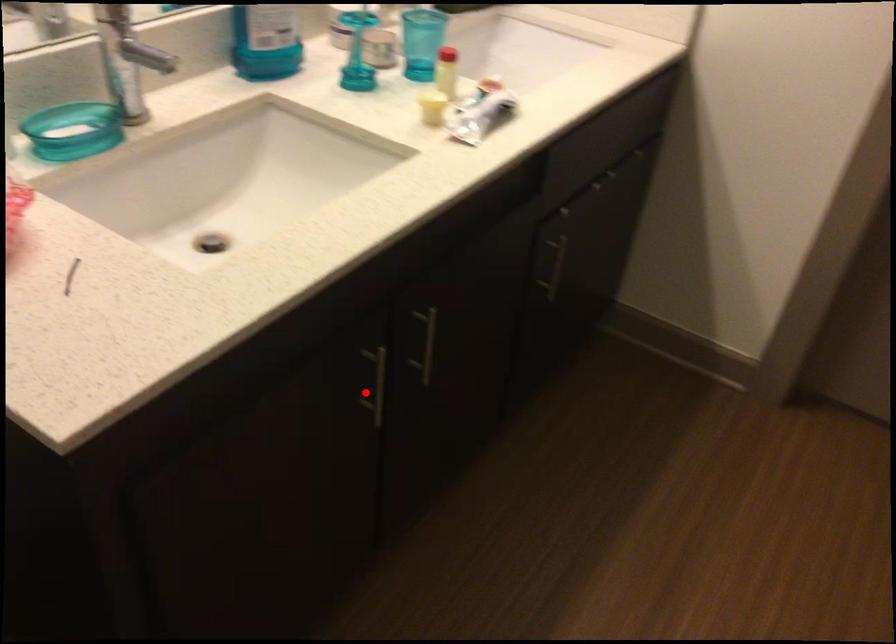
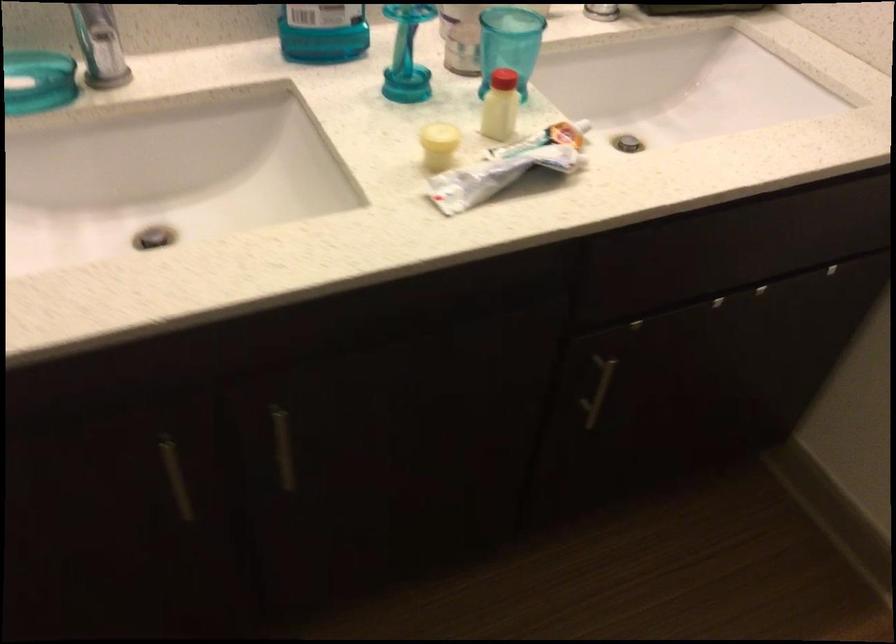
Question: I am providing you with two images of the same scene from different viewpoints. A red point is shown in image1. For the corresponding object point in image2, is it positioned nearer or farther from the camera?

Choices:
 (A) Nearer
 (B) Farther

Answer: (A)